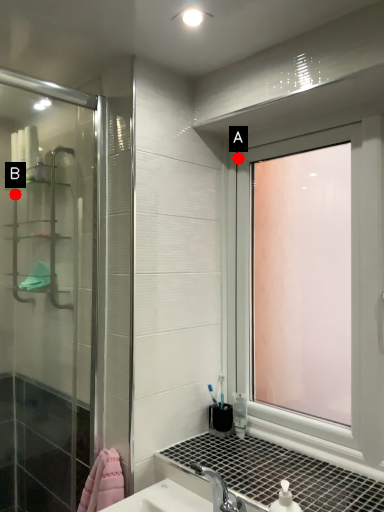
Question: Two points are circled on the image, labeled by A and B beside each circle. Which point is closer to the camera?

Choices:
 (A) A is closer
 (B) B is closer

Answer: (A)